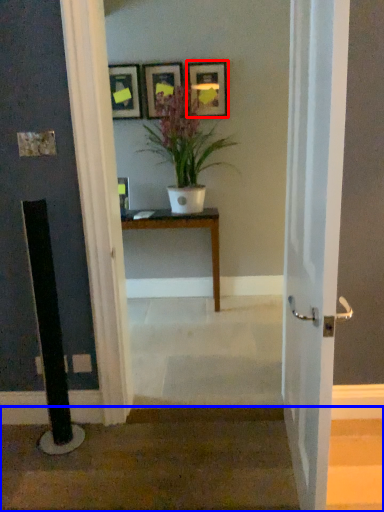
Question: Which object is closer to the camera taking this photo, picture frame (highlighted by a red box) or stairwell (highlighted by a blue box)?

Choices:
 (A) picture frame
 (B) stairwell

Answer: (B)